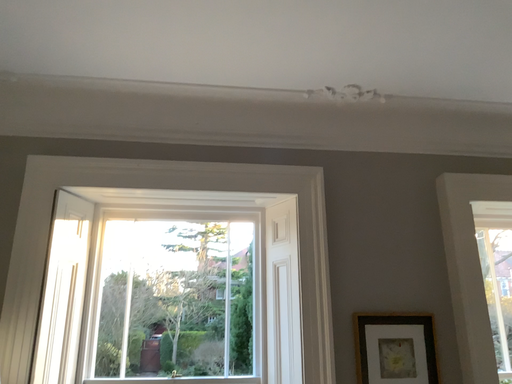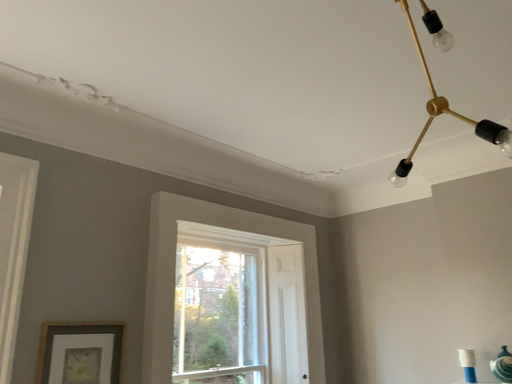
Question: Which way did the camera rotate in the video?

Choices:
 (A) rotated right
 (B) rotated left

Answer: (A)